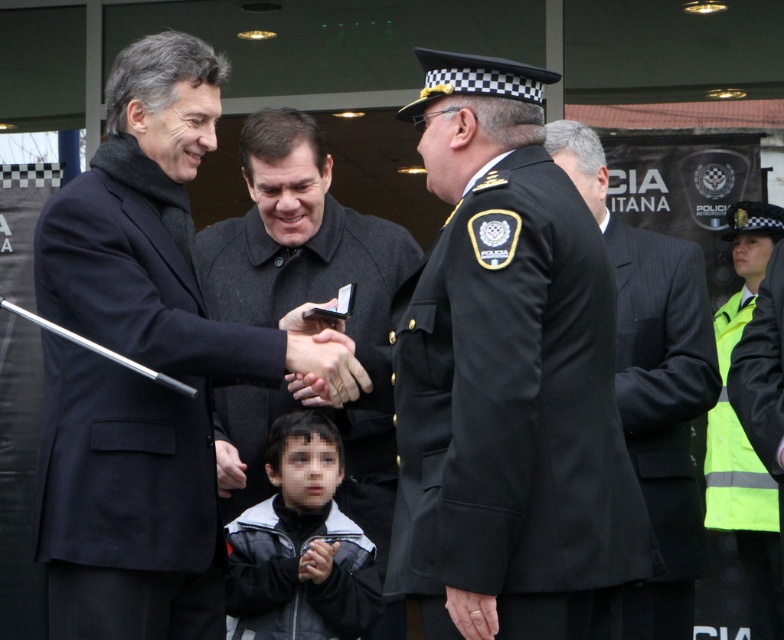
Question: Which object appears closest to the camera in this image?

Choices:
 (A) neon yellow reflective vest at right
 (B) dark gray wool coat at center
 (C) black fleece jacket at center
 (D) black uniform at center

Answer: (D)

Question: Can you confirm if black uniform at center is positioned below matte black coat at left?

Choices:
 (A) no
 (B) yes

Answer: (B)

Question: Can you confirm if black pinstripe suit at center is thinner than neon yellow reflective vest at right?

Choices:
 (A) no
 (B) yes

Answer: (A)

Question: Which point is closer to the camera?

Choices:
 (A) black fleece jacket at center
 (B) matte black coat at left
 (C) black uniform at center
 (D) black pinstripe suit at center

Answer: (C)

Question: Does matte black coat at left appear under dark gray wool coat at center?

Choices:
 (A) yes
 (B) no

Answer: (A)

Question: Which point is closer to the camera taking this photo?

Choices:
 (A) (581, 381)
 (B) (318, 627)
 (C) (633, 624)

Answer: (A)